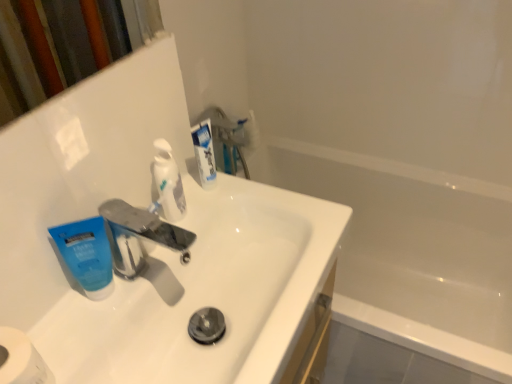
Measure the distance between white glossy toothpaste at upper center, which ranks as the 3th toothpaste in left-to-right order, and camera.

white glossy toothpaste at upper center, which ranks as the 3th toothpaste in left-to-right order, and camera are 86.70 centimeters apart from each other.

In order to face white matte toilet paper at lower left, should I rotate leftwards or rightwards?

Turn left by 30.784 degrees to look at white matte toilet paper at lower left.

What is the approximate height of white glossy sink at center?

white glossy sink at center is 30.79 inches tall.

Where is `white glossy bathtub at center`? white glossy bathtub at center is located at coordinates (412, 250).

How much space does white glossy toothpaste at center, which ranks as the second toothpaste in left-to-right order, occupy horizontally?

The width of white glossy toothpaste at center, which ranks as the second toothpaste in left-to-right order, is 1.33 inches.

Image resolution: width=512 pixels, height=384 pixels. What do you see at coordinates (168, 182) in the screenshot?
I see `white glossy toothpaste at center, which ranks as the second toothpaste in right-to-left order` at bounding box center [168, 182].

This screenshot has height=384, width=512. In order to click on white glossy toothpaste at upper center, which ranks as the 3th toothpaste in left-to-right order in this screenshot , I will do `click(204, 153)`.

Which of these two, white glossy sink at center or white glossy toothpaste at center, which ranks as the second toothpaste in right-to-left order, is bigger?

white glossy sink at center is bigger.

Is white glossy toothpaste at center, which ranks as the second toothpaste in left-to-right order, at the back of white glossy sink at center?

No, white glossy sink at center is not facing the opposite direction of white glossy toothpaste at center, which ranks as the second toothpaste in left-to-right order.

From the image's perspective, is white glossy sink at center positioned above or below white glossy toothpaste at center, which ranks as the second toothpaste in right-to-left order?

Clearly, from the image's perspective, white glossy sink at center is below white glossy toothpaste at center, which ranks as the second toothpaste in right-to-left order.

Visually, is blue matte toothpaste at left, which ranks as the 1th toothpaste in left-to-right order, positioned to the left or to the right of white matte toilet paper at lower left?

Based on their positions, blue matte toothpaste at left, which ranks as the 1th toothpaste in left-to-right order, is located to the right of white matte toilet paper at lower left.

Is white matte toilet paper at lower left inside blue matte toothpaste at left, which ranks as the 1th toothpaste in left-to-right order?

No, blue matte toothpaste at left, which ranks as the 1th toothpaste in left-to-right order, does not contain white matte toilet paper at lower left.

Is blue matte toothpaste at left, which is the third toothpaste from right to left, further to the viewer compared to white matte toilet paper at lower left?

Yes, it is.

Identify the location of the 1st toothpaste above when counting from the white matte toilet paper at lower left (from the image's perspective). (86, 255).

Image resolution: width=512 pixels, height=384 pixels. Find the location of `the 1st toothpaste above the white glossy bathtub at center (from the image's perspective)`. the 1st toothpaste above the white glossy bathtub at center (from the image's perspective) is located at coordinates (86, 255).

Is white glossy bathtub at center facing towards blue matte toothpaste at left, which ranks as the 1th toothpaste in left-to-right order?

No, white glossy bathtub at center is not turned towards blue matte toothpaste at left, which ranks as the 1th toothpaste in left-to-right order.

Considering the positions of objects white glossy bathtub at center and blue matte toothpaste at left, which ranks as the 1th toothpaste in left-to-right order, in the image provided, who is more to the left, white glossy bathtub at center or blue matte toothpaste at left, which ranks as the 1th toothpaste in left-to-right order,?

Positioned to the left is blue matte toothpaste at left, which ranks as the 1th toothpaste in left-to-right order.

Considering the sizes of objects white glossy bathtub at center and blue matte toothpaste at left, which is the third toothpaste from right to left, in the image provided, who is smaller, white glossy bathtub at center or blue matte toothpaste at left, which is the third toothpaste from right to left,?

With smaller size is blue matte toothpaste at left, which is the third toothpaste from right to left.

In the image, there is a blue matte toothpaste at left, which ranks as the 1th toothpaste in left-to-right order. At what (x,y) coordinates should I click in order to perform the action: click on sink below it (from a real-world perspective). Please return your answer as a coordinate pair (x, y). Looking at the image, I should click on (182, 300).

Does white glossy sink at center appear on the right side of blue matte toothpaste at left, which ranks as the 1th toothpaste in left-to-right order?

Yes.

Is white glossy sink at center turned away from blue matte toothpaste at left, which is the third toothpaste from right to left?

No, white glossy sink at center is not facing the opposite direction of blue matte toothpaste at left, which is the third toothpaste from right to left.

Which is in front, point (214, 278) or point (92, 222)?

Point (92, 222)

Which object is thinner, white glossy bathtub at center or white glossy sink at center?

white glossy sink at center is thinner.

From a real-world perspective, is white glossy bathtub at center above or below white glossy sink at center?

white glossy bathtub at center is situated lower than white glossy sink at center in the real world.

Based on the photo, is white glossy bathtub at center to the right of white glossy sink at center from the viewer's perspective?

Yes, white glossy bathtub at center is to the right of white glossy sink at center.

Is white glossy bathtub at center in front of or behind white glossy sink at center in the image?

white glossy bathtub at center is behind white glossy sink at center.

Considering the positions of objects blue matte toothpaste at left, which ranks as the 1th toothpaste in left-to-right order, and white glossy toothpaste at center, which ranks as the second toothpaste in right-to-left order, in the image provided, who is in front, blue matte toothpaste at left, which ranks as the 1th toothpaste in left-to-right order, or white glossy toothpaste at center, which ranks as the second toothpaste in right-to-left order,?

blue matte toothpaste at left, which ranks as the 1th toothpaste in left-to-right order.

Would you say blue matte toothpaste at left, which is the third toothpaste from right to left, is inside or outside white glossy toothpaste at center, which ranks as the second toothpaste in right-to-left order?

blue matte toothpaste at left, which is the third toothpaste from right to left, exists outside the volume of white glossy toothpaste at center, which ranks as the second toothpaste in right-to-left order.

Is blue matte toothpaste at left, which ranks as the 1th toothpaste in left-to-right order, bigger or smaller than white glossy toothpaste at center, which ranks as the second toothpaste in left-to-right order?

In the image, blue matte toothpaste at left, which ranks as the 1th toothpaste in left-to-right order, appears to be larger than white glossy toothpaste at center, which ranks as the second toothpaste in left-to-right order.

In the scene shown: In terms of size, does white glossy toothpaste at upper center, which ranks as the 3th toothpaste in left-to-right order, appear bigger or smaller than white glossy bathtub at center?

Considering their sizes, white glossy toothpaste at upper center, which ranks as the 3th toothpaste in left-to-right order, takes up less space than white glossy bathtub at center.

Considering the positions of objects white glossy toothpaste at upper center, which ranks as the 3th toothpaste in left-to-right order, and white glossy bathtub at center in the image provided, who is more to the right, white glossy toothpaste at upper center, which ranks as the 3th toothpaste in left-to-right order, or white glossy bathtub at center?

white glossy bathtub at center.

Is white glossy toothpaste at upper center, which ranks as the 3th toothpaste in left-to-right order, far from white glossy bathtub at center?

That's not correct — white glossy toothpaste at upper center, which ranks as the 3th toothpaste in left-to-right order, is a little close to white glossy bathtub at center.

Which object is closer to the camera, white glossy toothpaste at upper center, which ranks as the 3th toothpaste in left-to-right order, or white glossy bathtub at center?

Positioned in front is white glossy toothpaste at upper center, which ranks as the 3th toothpaste in left-to-right order.

Where is `the 2nd toothpaste behind the white glossy sink at center, starting your count from the anchor`? Image resolution: width=512 pixels, height=384 pixels. the 2nd toothpaste behind the white glossy sink at center, starting your count from the anchor is located at coordinates (168, 182).

This screenshot has width=512, height=384. Find the location of `toilet paper below the blue matte toothpaste at left, which ranks as the 1th toothpaste in left-to-right order (from a real-world perspective)`. toilet paper below the blue matte toothpaste at left, which ranks as the 1th toothpaste in left-to-right order (from a real-world perspective) is located at coordinates (21, 359).

When comparing their distances from white glossy sink at center, does white matte toilet paper at lower left or white glossy toothpaste at upper center, placed as the 1th toothpaste when sorted from right to left, seem further?

white matte toilet paper at lower left is positioned further to the anchor white glossy sink at center.

When comparing their distances from white glossy bathtub at center, does blue matte toothpaste at left, which ranks as the 1th toothpaste in left-to-right order, or white glossy toothpaste at upper center, which ranks as the 3th toothpaste in left-to-right order, seem closer?

white glossy toothpaste at upper center, which ranks as the 3th toothpaste in left-to-right order, is positioned closer to the anchor white glossy bathtub at center.

Looking at the image, which one is located further to white glossy bathtub at center, metallic silver faucet at center or white glossy toothpaste at upper center, placed as the 1th toothpaste when sorted from right to left?

Among the two, metallic silver faucet at center is located further to white glossy bathtub at center.

From the image, which object appears to be nearer to white glossy toothpaste at upper center, placed as the 1th toothpaste when sorted from right to left, white matte toilet paper at lower left or white glossy sink at center?

Based on the image, white glossy sink at center appears to be nearer to white glossy toothpaste at upper center, placed as the 1th toothpaste when sorted from right to left.

Considering their positions, is white glossy toothpaste at center, which ranks as the second toothpaste in right-to-left order, positioned further to blue matte toothpaste at left, which ranks as the 1th toothpaste in left-to-right order, than white glossy bathtub at center?

white glossy bathtub at center is positioned further to the anchor blue matte toothpaste at left, which ranks as the 1th toothpaste in left-to-right order.

From the image, which object appears to be nearer to blue matte toothpaste at left, which ranks as the 1th toothpaste in left-to-right order, white glossy bathtub at center or white glossy toothpaste at center, which ranks as the second toothpaste in left-to-right order?

The object closer to blue matte toothpaste at left, which ranks as the 1th toothpaste in left-to-right order, is white glossy toothpaste at center, which ranks as the second toothpaste in left-to-right order.

When comparing their distances from white glossy toothpaste at center, which ranks as the second toothpaste in right-to-left order, does white matte toilet paper at lower left or blue matte toothpaste at left, which is the third toothpaste from right to left, seem further?

Based on the image, white matte toilet paper at lower left appears to be further to white glossy toothpaste at center, which ranks as the second toothpaste in right-to-left order.

Looking at this image, estimate the real-world distances between objects in this image. Which object is further from white glossy toothpaste at center, which ranks as the second toothpaste in right-to-left order, metallic silver faucet at center or white glossy sink at center?

The object further to white glossy toothpaste at center, which ranks as the second toothpaste in right-to-left order, is white glossy sink at center.

At what (x,y) coordinates should I click in order to perform the action: click on sink situated between white glossy toothpaste at center, which ranks as the second toothpaste in left-to-right order, and white glossy bathtub at center from left to right. Please return your answer as a coordinate pair (x, y). This screenshot has width=512, height=384. Looking at the image, I should click on (182, 300).

Locate an element on the screen. The width and height of the screenshot is (512, 384). toothpaste between white glossy toothpaste at center, which ranks as the second toothpaste in left-to-right order, and white glossy sink at center vertically is located at coordinates (86, 255).

What are the coordinates of `faucet that lies between white glossy toothpaste at center, which ranks as the second toothpaste in left-to-right order, and blue matte toothpaste at left, which is the third toothpaste from right to left, from top to bottom` in the screenshot? It's located at (139, 235).

Where is `toilet paper that lies between white glossy toothpaste at upper center, which ranks as the 3th toothpaste in left-to-right order, and white glossy sink at center from top to bottom`? The image size is (512, 384). toilet paper that lies between white glossy toothpaste at upper center, which ranks as the 3th toothpaste in left-to-right order, and white glossy sink at center from top to bottom is located at coordinates pos(21,359).